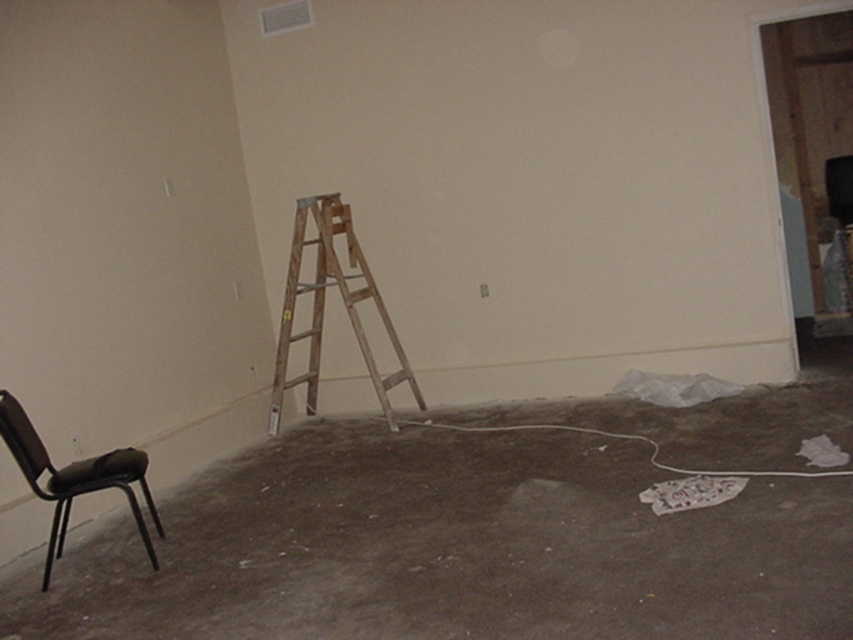
Is wooden ladder at center positioned at the back of brown leather chair at lower left?

Yes, it is behind brown leather chair at lower left.

Is point (339, 193) closer to camera compared to point (85, 476)?

No.

Where is `wooden ladder at center`? This screenshot has width=853, height=640. wooden ladder at center is located at coordinates (323, 307).

You are a GUI agent. You are given a task and a screenshot of the screen. Output one action in this format:
    pyautogui.click(x=<x>, y=<y>)
    Task: Click on the wooden ladder at center
    The image size is (853, 640).
    Given the screenshot: What is the action you would take?
    pyautogui.click(x=323, y=307)